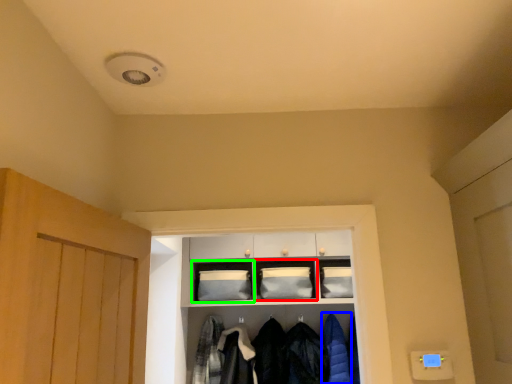
Question: Which object is the closest to the shelf (highlighted by a red box)? Choose among these: clothing (highlighted by a blue box) or cabinetry (highlighted by a green box).

Choices:
 (A) clothing
 (B) cabinetry

Answer: (B)